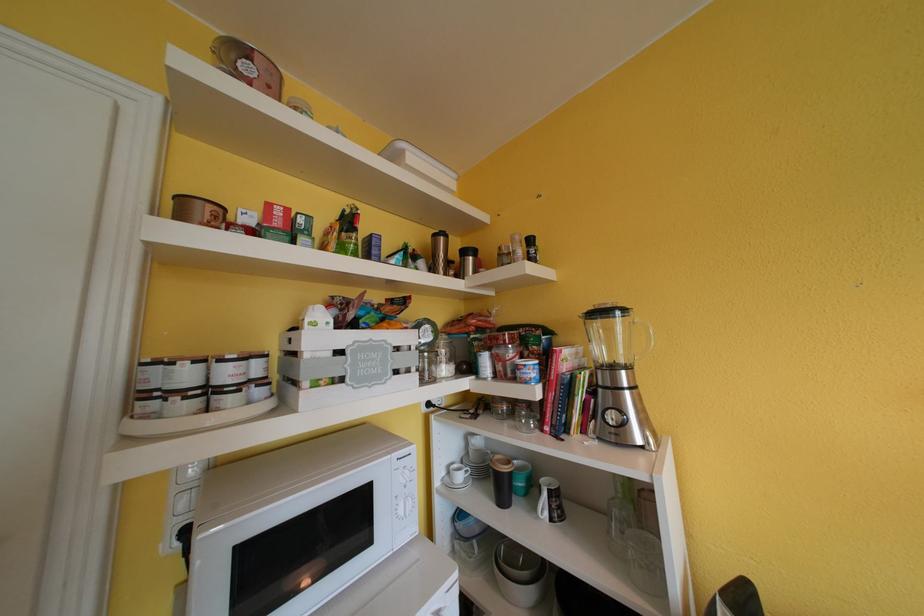
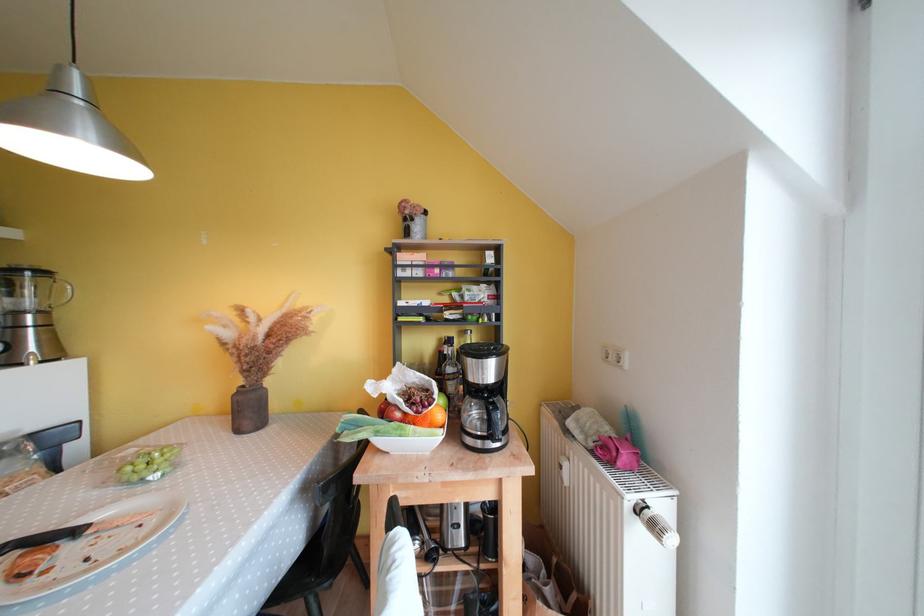
Locate, in the second image, the point that corresponds to (636,371) in the first image.

(49, 315)